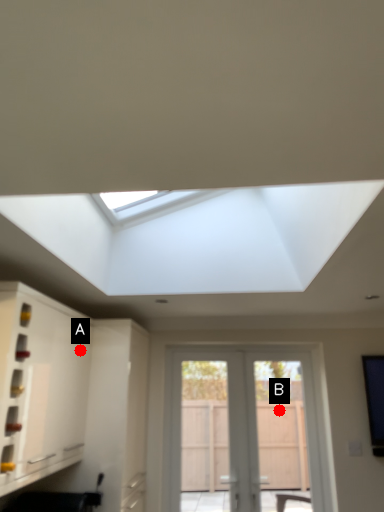
Question: Two points are circled on the image, labeled by A and B beside each circle. Which of the following is the farthest from the observer?

Choices:
 (A) A is further
 (B) B is further

Answer: (B)